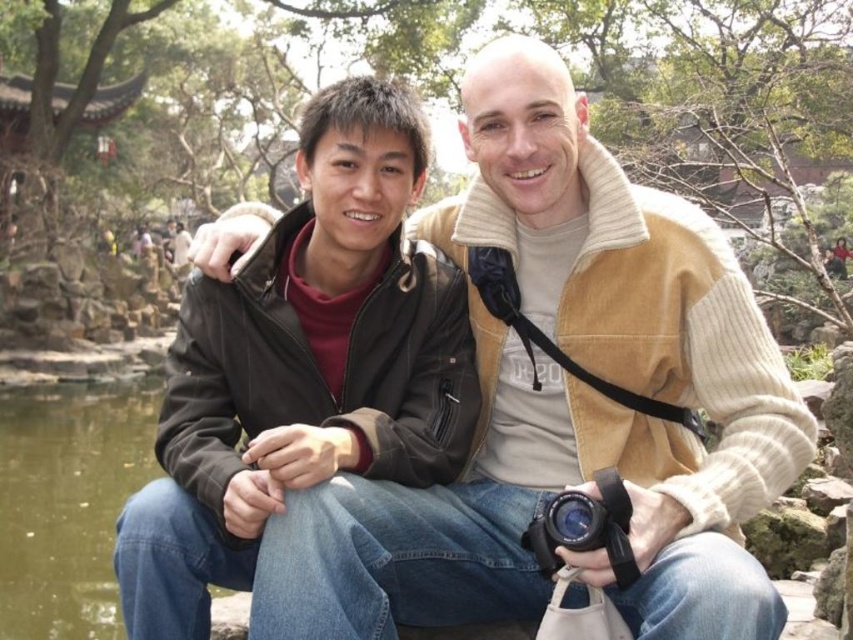
Question: Among these points, which one is nearest to the camera?

Choices:
 (A) (366, 323)
 (B) (606, 518)
 (C) (10, 499)
 (D) (705, 538)

Answer: (D)

Question: Based on their relative distances, which object is nearer to the greenish water at lower left?

Choices:
 (A) black rubber camera at lower center
 (B) matte black jacket at center

Answer: (B)

Question: Can you confirm if greenish water at lower left is positioned to the left of black rubber camera at lower center?

Choices:
 (A) no
 (B) yes

Answer: (B)

Question: Can you confirm if matte black jacket at center is positioned to the left of greenish water at lower left?

Choices:
 (A) yes
 (B) no

Answer: (B)

Question: Is matte black jacket at center above black rubber camera at lower center?

Choices:
 (A) yes
 (B) no

Answer: (A)

Question: Estimate the real-world distances between objects in this image. Which object is closer to the matte black jacket at left?

Choices:
 (A) matte black jacket at center
 (B) black rubber camera at lower center
 (C) greenish water at lower left

Answer: (A)